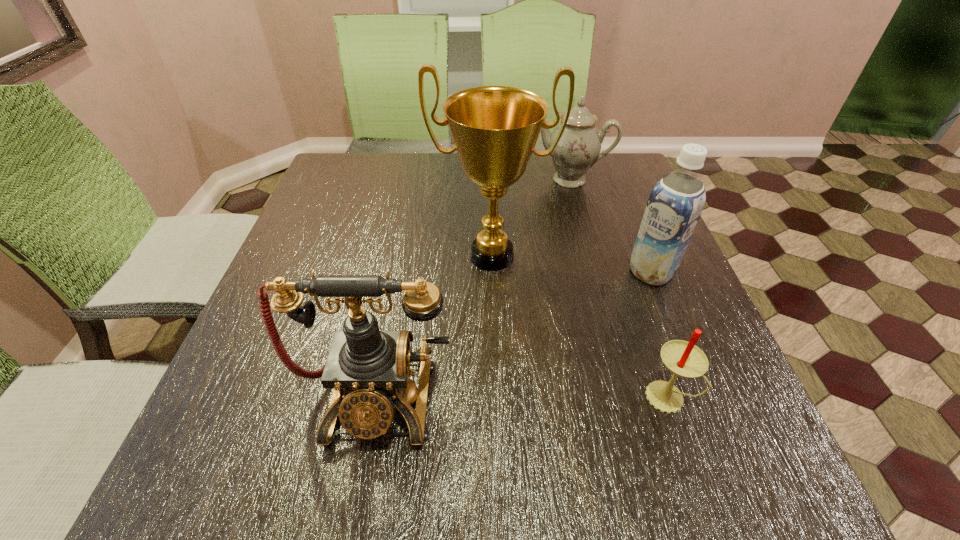
This screenshot has height=540, width=960. What are the coordinates of `free spot between the soya milk and the award` in the screenshot? It's located at (571, 264).

Where is `vacant point located between the telephone and the shortest object`? The image size is (960, 540). vacant point located between the telephone and the shortest object is located at coordinates (522, 397).

Locate an element on the screen. The width and height of the screenshot is (960, 540). blank region between the soya milk and the chinaware is located at coordinates (610, 226).

Locate which object is the fourth closest to the telephone. Please provide its 2D coordinates. Your answer should be formatted as a tuple, i.e. [(x, y)], where the tuple contains the x and y coordinates of a point satisfying the conditions above.

[(578, 149)]

Point out which object is positioned as the second nearest to the telephone. Please provide its 2D coordinates. Your answer should be formatted as a tuple, i.e. [(x, y)], where the tuple contains the x and y coordinates of a point satisfying the conditions above.

[(684, 359)]

Identify the location of vacant region that satisfies the following two spatial constraints: 1. on the front side of the soya milk; 2. on the right side of the chinaware. (594, 272).

You are a GUI agent. You are given a task and a screenshot of the screen. Output one action in this format:
    pyautogui.click(x=<x>, y=<y>)
    Task: Click on the vacant position in the image that satisfies the following two spatial constraints: 1. on the front side of the chinaware; 2. on the left side of the shortest object
    
    Given the screenshot: What is the action you would take?
    pyautogui.click(x=628, y=396)